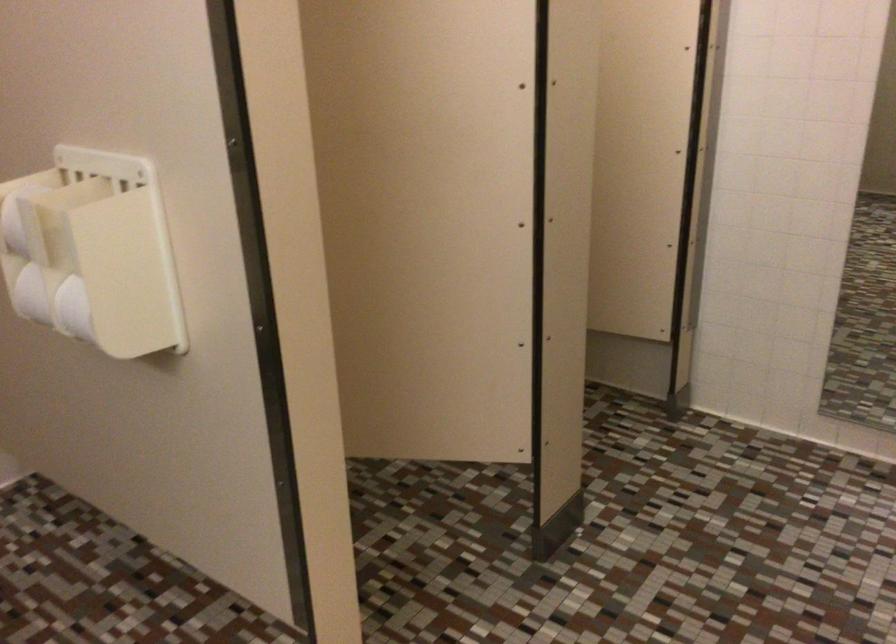
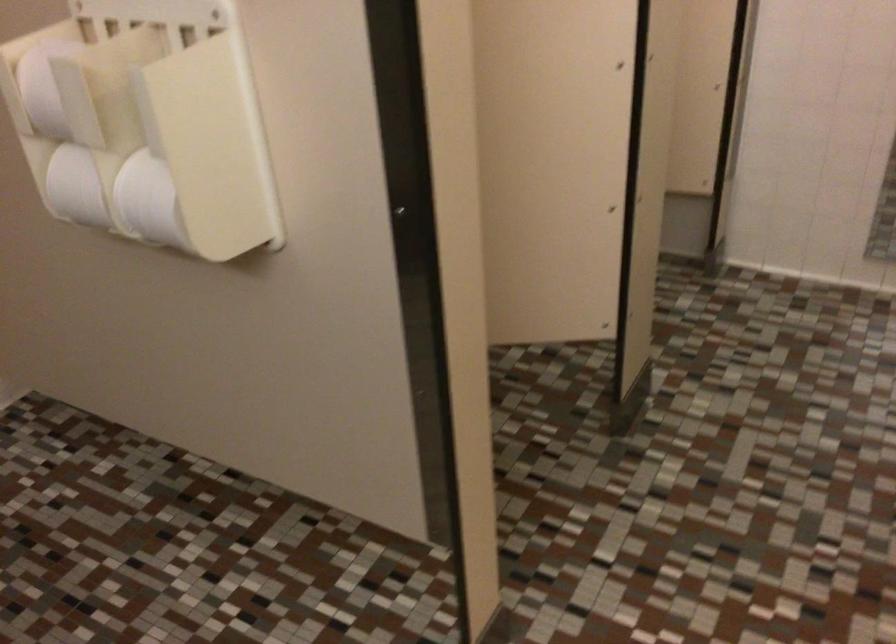
Question: The images are taken continuously from a first-person perspective. In which direction is your viewpoint rotating?

Choices:
 (A) Left
 (B) Right
 (C) Up
 (D) Down

Answer: (D)